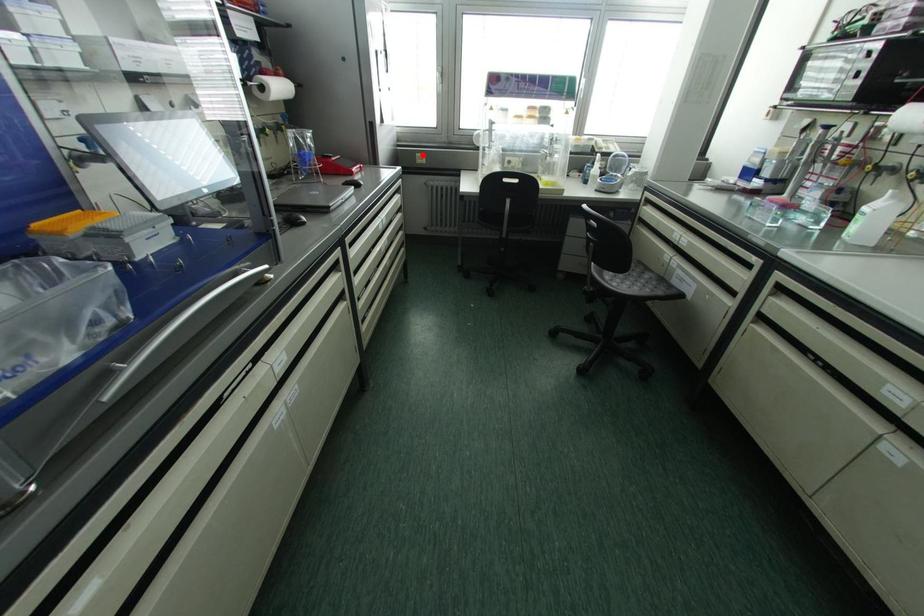
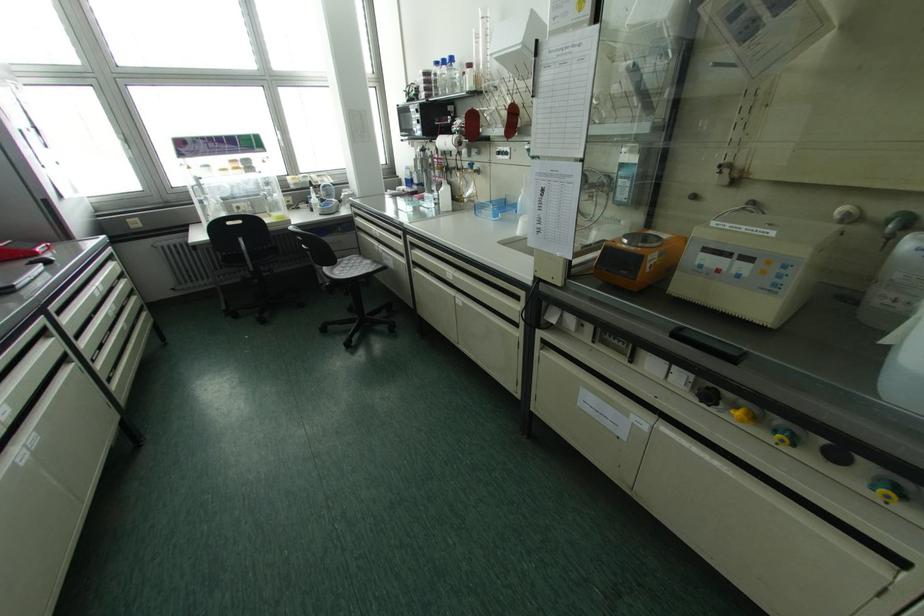
Where in the second image is the point corresponding to the highlighted location from the first image?

(137, 219)